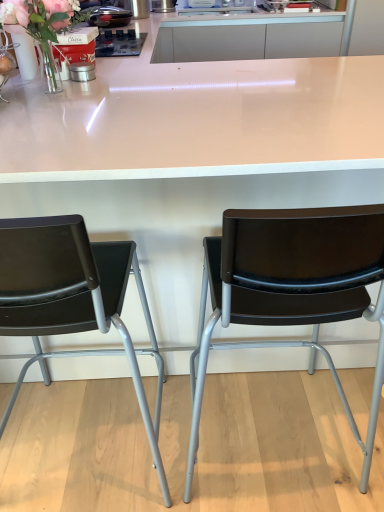
Identify the location of free location to the right of metallic tin at upper left, marked as the first appliance in a front-to-back arrangement. The height and width of the screenshot is (512, 384). (132, 73).